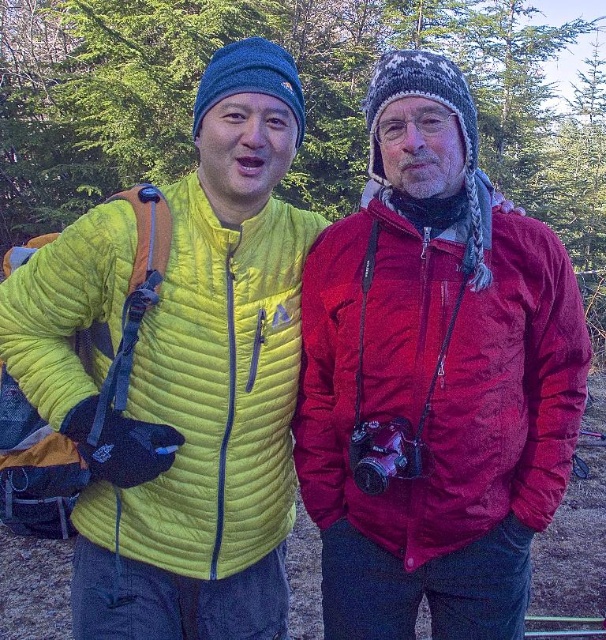
You are trying to decide which jacket to wear for a hike. The velvet red jacket at center is narrower than the matte yellow jacket at left. Which jacket would allow you to move more freely in the dense forest? Explain your reasoning.

The velvet red jacket at center has a narrower width compared to the matte yellow jacket at left, making it easier to maneuver through tight spaces in the dense forest. A narrower jacket reduces the chance of getting caught on branches or bushes, allowing for more freedom of movement.

You are a photographer trying to capture both the velvet red jacket at center and the matte yellow jacket at left in a single frame. Based on their positions, which jacket will appear larger in the photo?

The velvet red jacket at center will appear larger in the photo because it is located above the matte yellow jacket at left, which typically means it is closer to the camera, making it appear bigger.